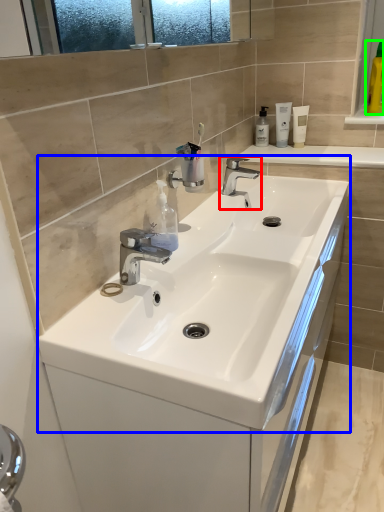
Question: Based on their relative distances, which object is farther from tap (highlighted by a red box)? Choose from sink (highlighted by a blue box) and mouthwash (highlighted by a green box).

Choices:
 (A) sink
 (B) mouthwash

Answer: (B)